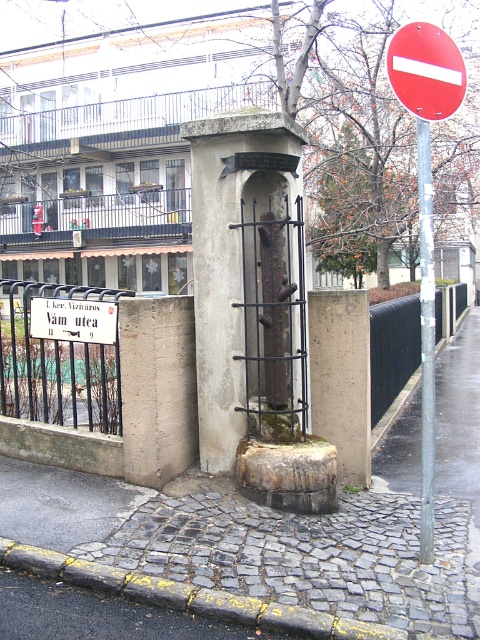
You are a delivery person trying to park your van near the shrine. The van requires a space larger than the yellow painted concrete curb at lower center. Is there enough space on the cobblestone pavement at center to park?

The cobblestone pavement at center is larger in size than the yellow painted concrete curb at lower center, so yes, there is enough space on the cobblestone pavement at center to park the van.

What is the 2D coordinate of the cobblestone pavement at center?

The 2D coordinate of the cobblestone pavement at center is at point (289, 522).

You are a delivery person trying to park your van near the shrine. The van requires a parking spot that must be at least 3 meters long. Based on the scene, can you determine if the cobblestone pavement at center is suitable for parking?

The position of cobblestone pavement at center is at point [289,522]. However, without knowing the dimensions or length of the cobblestone pavement, it is impossible to determine if it meets the required 3 meters for parking.